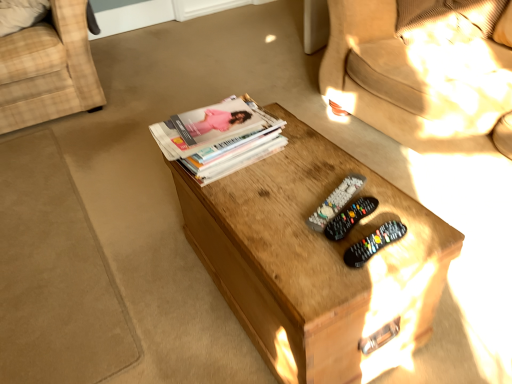
Where is `vacant area that is in front of black plastic remote at center, marked as the 1th remote control in a back-to-front arrangement`? This screenshot has height=384, width=512. vacant area that is in front of black plastic remote at center, marked as the 1th remote control in a back-to-front arrangement is located at coordinates (333, 266).